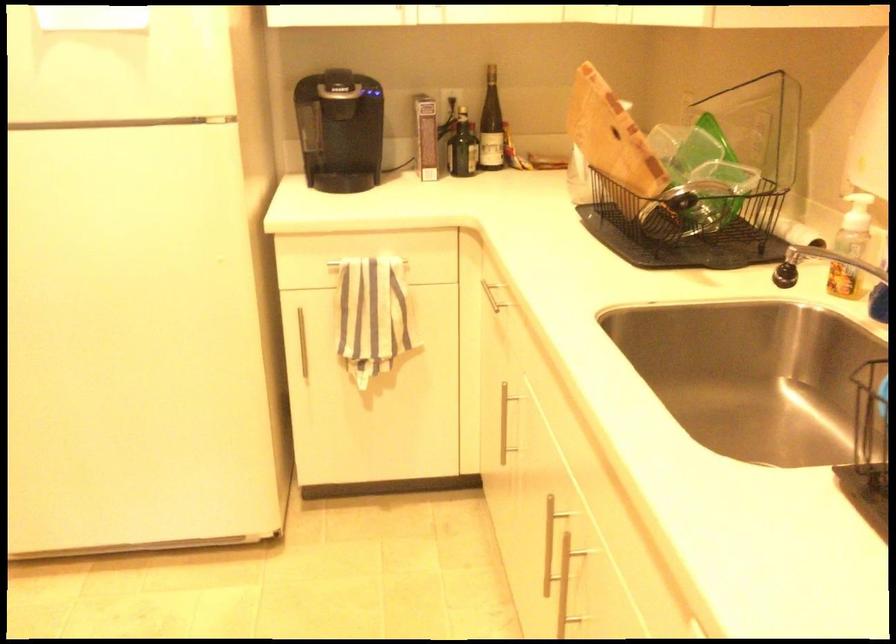
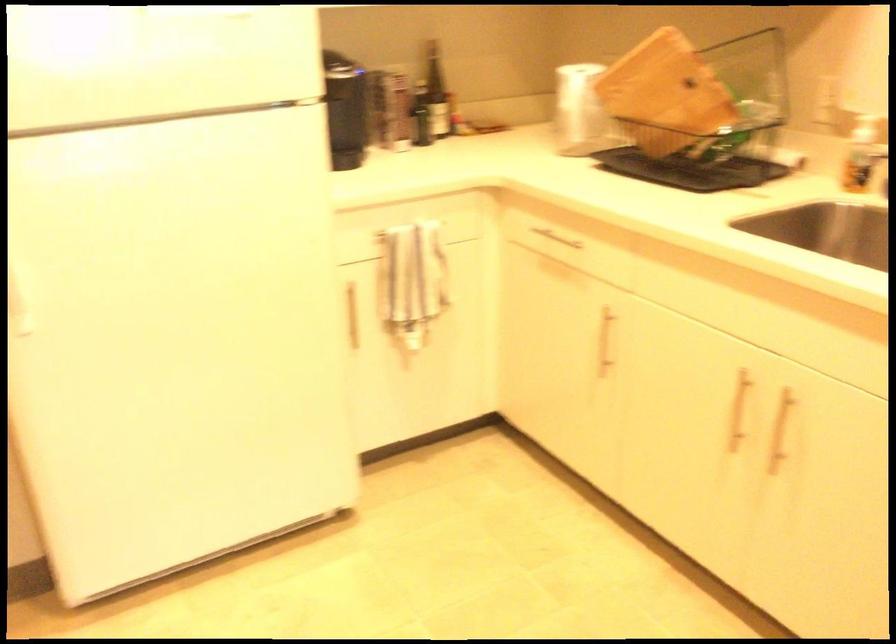
Locate, in the second image, the point that corresponds to the point at 607,147 in the first image.

(665, 93)